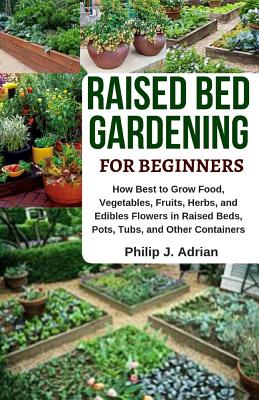
Locate an element on the screen. The height and width of the screenshot is (400, 259). bed is located at coordinates (218, 93).